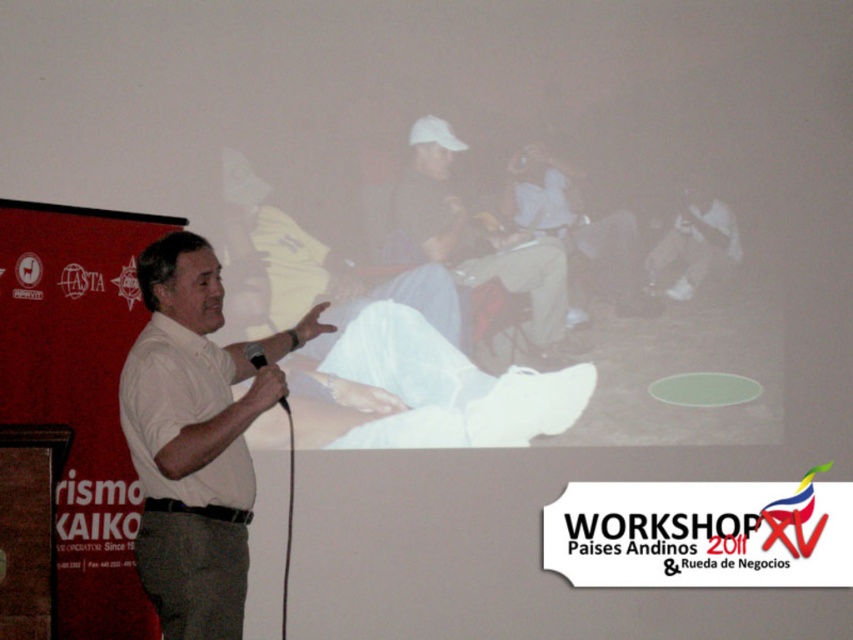
Which is more to the right, matte white shirt at center or matte black shirt at center?

From the viewer's perspective, matte black shirt at center appears more on the right side.

Is point (308, 300) less distant than point (479, 253)?

Yes, it is in front of point (479, 253).

Who is more forward, (265, 234) or (485, 344)?

Positioned in front is point (265, 234).

Locate an element on the screen. The height and width of the screenshot is (640, 853). matte white shirt at center is located at coordinates (274, 257).

Is point (161, 324) positioned after point (556, 195)?

No, (161, 324) is closer to viewer.

Can you confirm if white shirt at center is positioned above light beige pants at center?

No, white shirt at center is not above light beige pants at center.

Find the location of `white shirt at center`. white shirt at center is located at coordinates (194, 438).

Where is `white shirt at center`? This screenshot has height=640, width=853. white shirt at center is located at coordinates (194, 438).

Locate an element on the screen. matte white shirt at center is located at coordinates (274, 257).

Is matte white shirt at center above white matte shirt at center?

No.

The height and width of the screenshot is (640, 853). I want to click on matte white shirt at center, so click(274, 257).